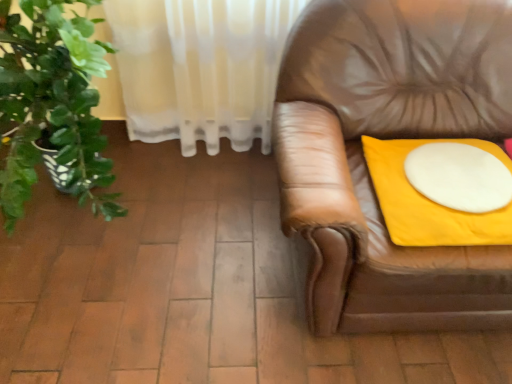
Image resolution: width=512 pixels, height=384 pixels. Describe the element at coordinates (459, 176) in the screenshot. I see `white matte round table at right` at that location.

Locate an element on the screen. Image resolution: width=512 pixels, height=384 pixels. white matte round table at right is located at coordinates (459, 176).

Where is `yellow fabric cushion at right`? yellow fabric cushion at right is located at coordinates (442, 190).

This screenshot has height=384, width=512. Describe the element at coordinates (442, 190) in the screenshot. I see `yellow fabric cushion at right` at that location.

Locate an element on the screen. This screenshot has width=512, height=384. white matte round table at right is located at coordinates (459, 176).

Does white matte round table at right appear on the right side of yellow fabric cushion at right?

Correct, you'll find white matte round table at right to the right of yellow fabric cushion at right.

Considering the relative positions of white matte round table at right and yellow fabric cushion at right in the image provided, is white matte round table at right in front of yellow fabric cushion at right?

No, white matte round table at right is further to the viewer.

Which point is more forward, (x=490, y=179) or (x=503, y=156)?

Point (x=490, y=179)

From the picture: From the image's perspective, which is below, white matte round table at right or yellow fabric cushion at right?

yellow fabric cushion at right is shown below in the image.

Based on the photo, from a real-world perspective, is white matte round table at right located higher than yellow fabric cushion at right?

Correct, in the physical world, white matte round table at right is higher than yellow fabric cushion at right.

Which object is wider, white matte round table at right or yellow fabric cushion at right?

With larger width is yellow fabric cushion at right.

Considering the relative sizes of white matte round table at right and yellow fabric cushion at right in the image provided, is white matte round table at right taller than yellow fabric cushion at right?

No.

Considering the sizes of white matte round table at right and yellow fabric cushion at right in the image, is white matte round table at right bigger or smaller than yellow fabric cushion at right?

Clearly, white matte round table at right is smaller in size than yellow fabric cushion at right.

Would you say white matte round table at right is inside or outside yellow fabric cushion at right?

white matte round table at right is contained in yellow fabric cushion at right.

Are white matte round table at right and yellow fabric cushion at right located far from each other?

Actually, white matte round table at right and yellow fabric cushion at right are a little close together.

Is white matte round table at right oriented away from yellow fabric cushion at right?

Absolutely, white matte round table at right is directed away from yellow fabric cushion at right.

How different are the orientations of white matte round table at right and yellow fabric cushion at right in degrees?

They differ by 0.00029 degrees in their facing directions.

How much distance is there between white matte round table at right and yellow fabric cushion at right?

white matte round table at right is 0.98 inches from yellow fabric cushion at right.

Find the location of a particular element. blanket lying on the left of white matte round table at right is located at coordinates (442, 190).

Can you confirm if yellow fabric cushion at right is positioned to the left of white matte round table at right?

Yes, yellow fabric cushion at right is to the left of white matte round table at right.

Is yellow fabric cushion at right closer to the viewer compared to white matte round table at right?

Yes, yellow fabric cushion at right is closer to the camera.

Which is closer to the camera, (400, 229) or (456, 168)?

The point (400, 229) is in front.

From the image's perspective, between yellow fabric cushion at right and white matte round table at right, who is located below?

yellow fabric cushion at right.

From a real-world perspective, is yellow fabric cushion at right located beneath white matte round table at right?

Yes, from a real-world perspective, yellow fabric cushion at right is beneath white matte round table at right.

Considering the relative sizes of yellow fabric cushion at right and white matte round table at right in the image provided, is yellow fabric cushion at right wider than white matte round table at right?

Yes.

Considering the sizes of objects yellow fabric cushion at right and white matte round table at right in the image provided, who is shorter, yellow fabric cushion at right or white matte round table at right?

Standing shorter between the two is white matte round table at right.

In the scene shown: Does yellow fabric cushion at right have a larger size compared to white matte round table at right?

Yes, yellow fabric cushion at right is bigger than white matte round table at right.

Do you think yellow fabric cushion at right is within white matte round table at right, or outside of it?

yellow fabric cushion at right is not inside white matte round table at right, it's outside.

Is the surface of yellow fabric cushion at right in direct contact with white matte round table at right?

Yes, yellow fabric cushion at right is right next to white matte round table at right and making contact.

Is yellow fabric cushion at right oriented towards white matte round table at right?

No, yellow fabric cushion at right is not oriented towards white matte round table at right.

At what (x,y) coordinates should I click in order to perform the action: click on round table above the yellow fabric cushion at right (from the image's perspective). Please return your answer as a coordinate pair (x, y). The width and height of the screenshot is (512, 384). Looking at the image, I should click on (459, 176).

The image size is (512, 384). I want to click on round table to the right of yellow fabric cushion at right, so click(x=459, y=176).

In order to click on blanket that is below the white matte round table at right (from the image's perspective) in this screenshot , I will do `click(442, 190)`.